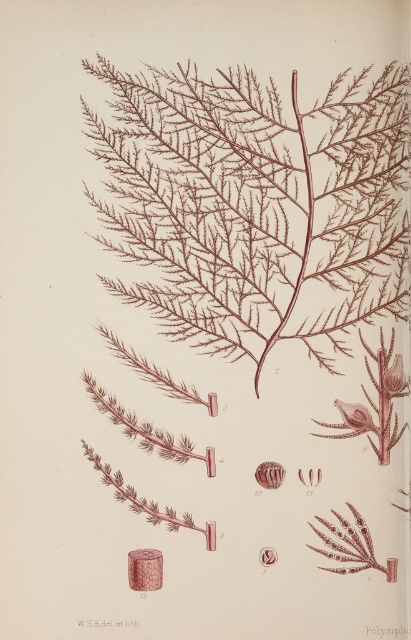
You are examining the botanical illustration and notice the brown textured plant at center. Can you determine its exact location within the image using the coordinate system provided?

The brown textured plant at center is located at coordinate point (x=253, y=204).

You are an underwater photographer aiming to capture both the brown textured plant at center and the matte pink flower at upper right in a single frame. Given their sizes, which one should you focus on to ensure both fit clearly in the photo?

The brown textured plant at center is larger than the matte pink flower at upper right, so focusing on the brown textured plant at center will help ensure both fit clearly in the photo.